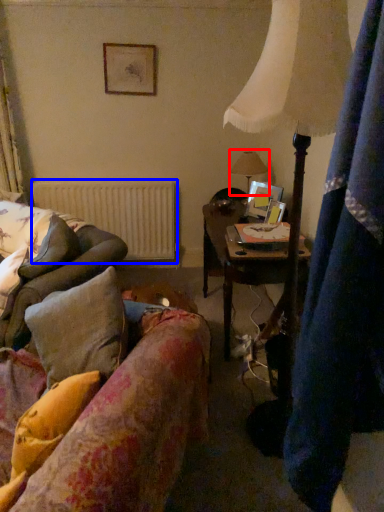
Question: Which object appears farthest to the camera in this image, table lamp (highlighted by a red box) or radiator (highlighted by a blue box)?

Choices:
 (A) table lamp
 (B) radiator

Answer: (B)